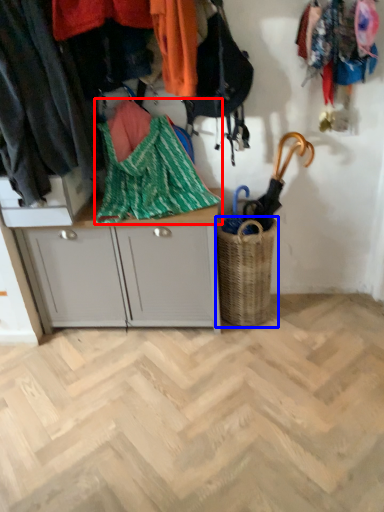
Question: Which object is closer to the camera taking this photo, blanket (highlighted by a red box) or basket (highlighted by a blue box)?

Choices:
 (A) blanket
 (B) basket

Answer: (A)